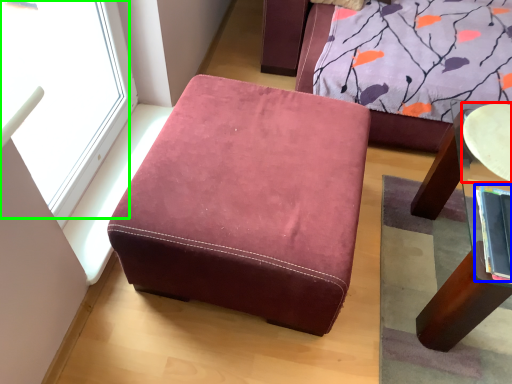
Question: Which object is the farthest from round table (highlighted by a red box)? Choose among these: book (highlighted by a blue box) or window (highlighted by a green box).

Choices:
 (A) book
 (B) window

Answer: (B)